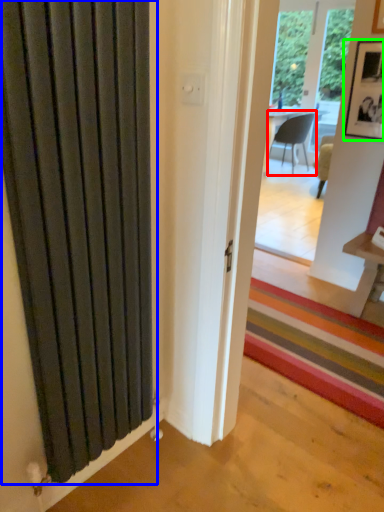
Question: Which object is positioned farthest from chair (highlighted by a red box)? Select from door (highlighted by a blue box) and picture frame (highlighted by a green box).

Choices:
 (A) door
 (B) picture frame

Answer: (A)